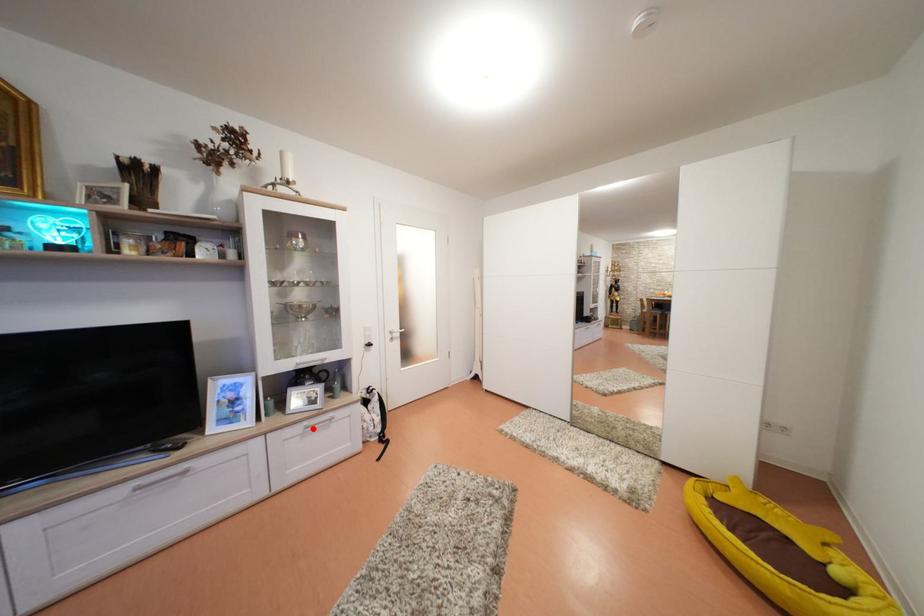
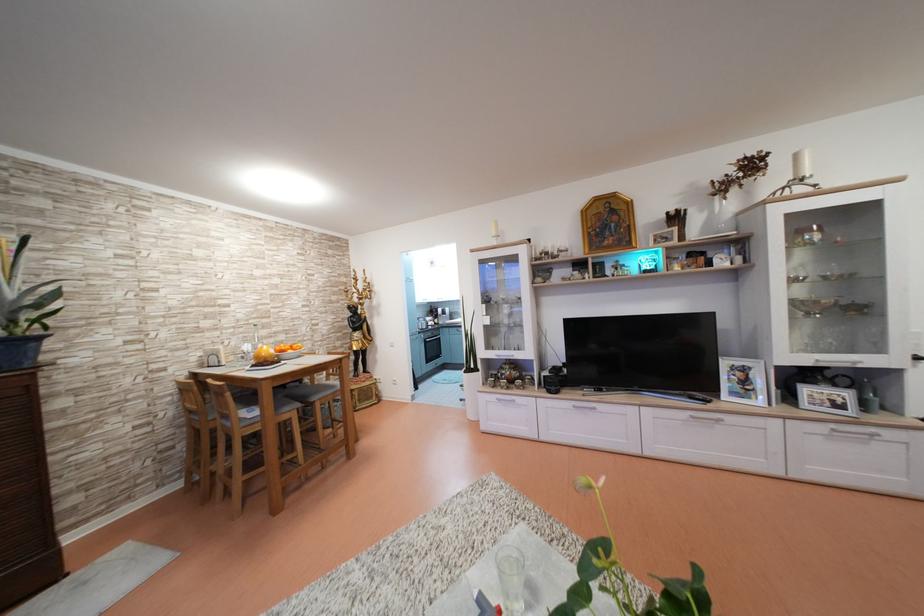
Question: I am providing you with two images of the same scene from different viewpoints. A red point is shown in image1. For the corresponding object point in image2, is it positioned nearer or farther from the camera?

Choices:
 (A) Nearer
 (B) Farther

Answer: (A)